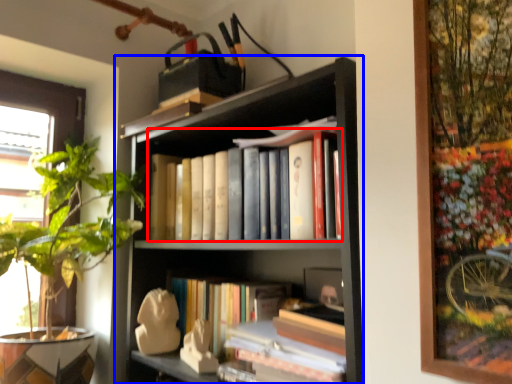
Question: Which of the following is the farthest to the observer, book (highlighted by a red box) or bookcase (highlighted by a blue box)?

Choices:
 (A) book
 (B) bookcase

Answer: (A)